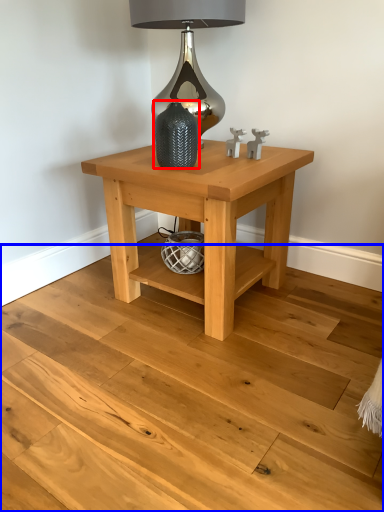
Question: Which object appears closest to the camera in this image, vase (highlighted by a red box) or stair (highlighted by a blue box)?

Choices:
 (A) vase
 (B) stair

Answer: (B)